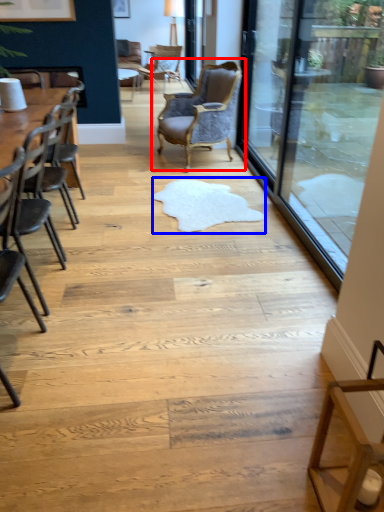
Question: Which of the following is the farthest to the observer, chair (highlighted by a red box) or mat (highlighted by a blue box)?

Choices:
 (A) chair
 (B) mat

Answer: (A)